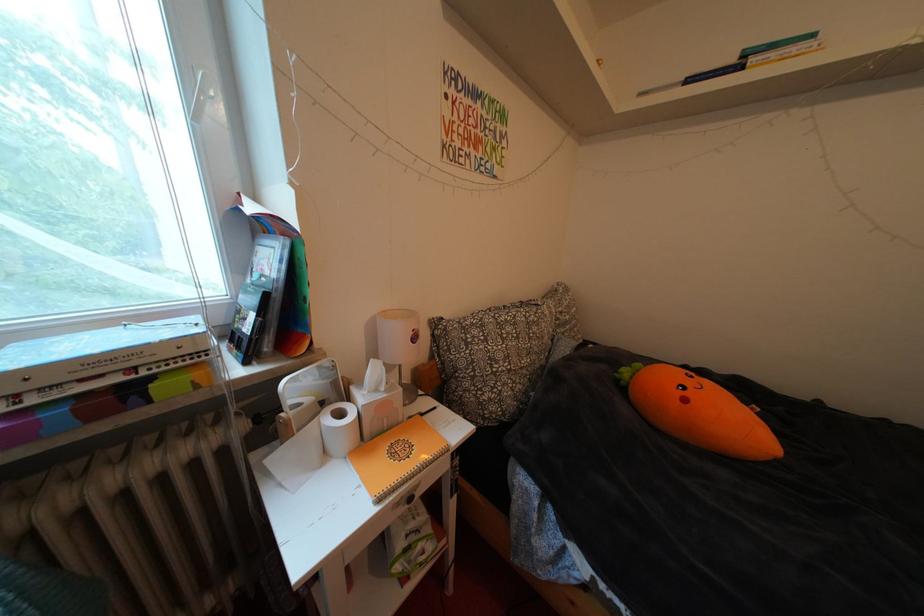
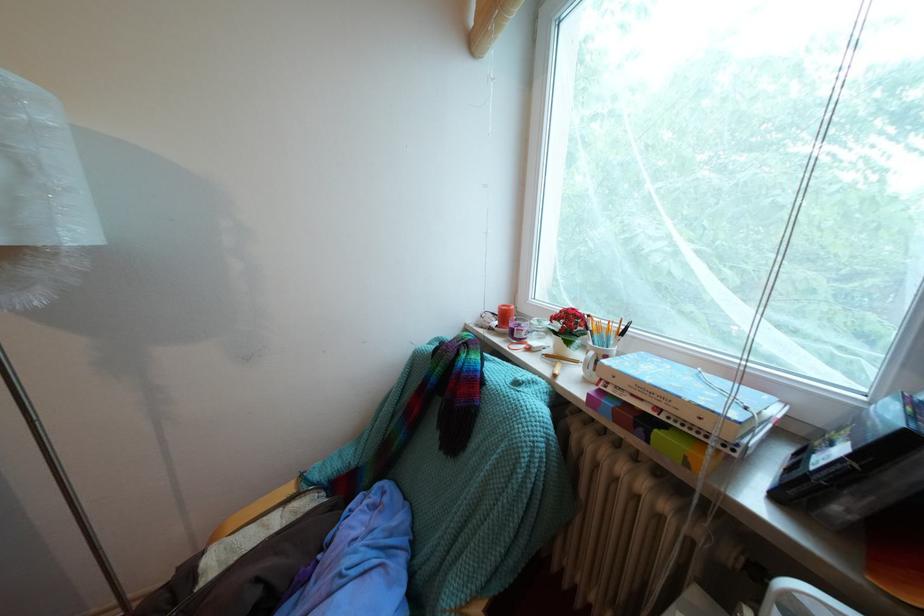
Based on the continuous images, in which direction is the camera rotating?

The rotation direction of the camera is left-down.